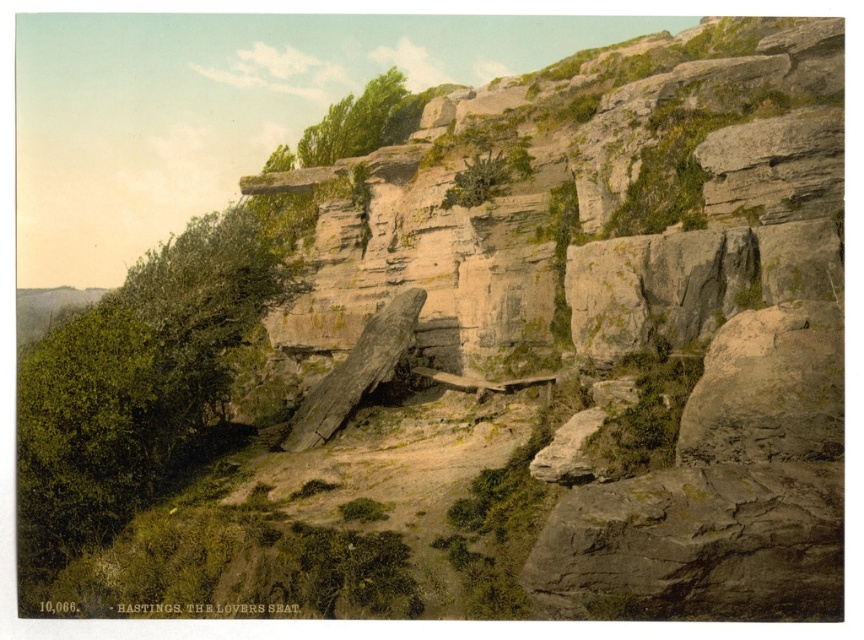
Question: Can you confirm if green leafy bush at left is smaller than green leafy tree at upper center?

Choices:
 (A) yes
 (B) no

Answer: (B)

Question: Does smooth gray rock at center right appear on the left side of gray rock at center?

Choices:
 (A) no
 (B) yes

Answer: (A)

Question: Which point is closer to the camera?

Choices:
 (A) (296, 147)
 (B) (608, 344)
 (C) (108, 342)

Answer: (B)

Question: Which point is farther to the camera?

Choices:
 (A) green leafy tree at upper center
 (B) green leafy bush at left
 (C) smooth gray rock at center right

Answer: (A)

Question: Among these objects, which one is nearest to the camera?

Choices:
 (A) green leafy bush at left
 (B) smooth gray rock at center right
 (C) green leafy tree at upper center

Answer: (B)

Question: Is green leafy bush at left closer to the viewer compared to gray rock at center?

Choices:
 (A) yes
 (B) no

Answer: (B)